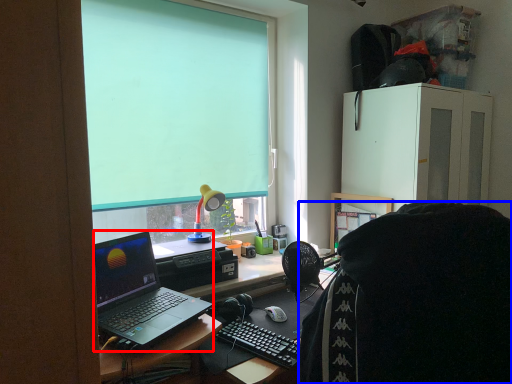
Question: Which object is further to the camera taking this photo, laptop (highlighted by a red box) or person (highlighted by a blue box)?

Choices:
 (A) laptop
 (B) person

Answer: (A)